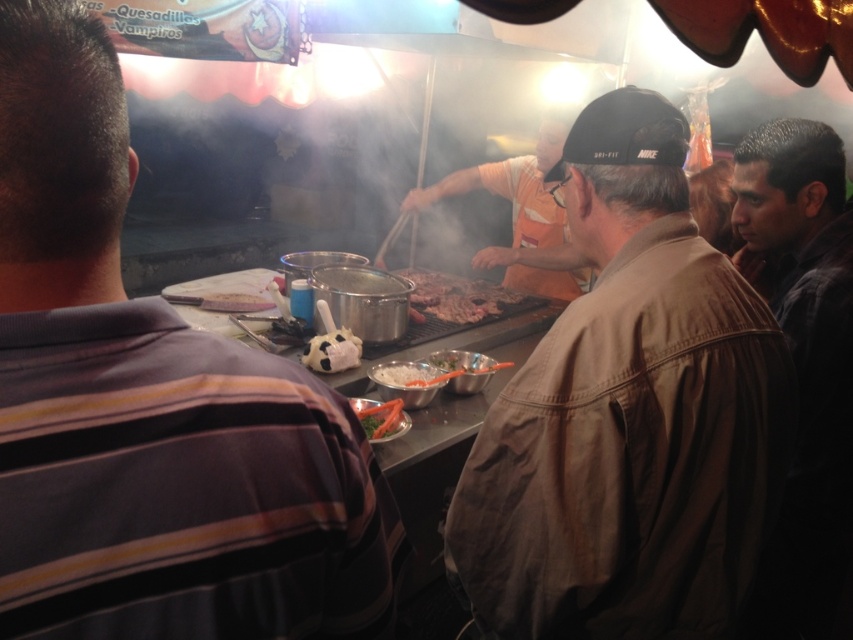
Is the position of dark brown leather jacket at right less distant than that of white matte soccer ball at center?

That is True.

Does dark brown leather jacket at right appear on the right side of white matte soccer ball at center?

Indeed, dark brown leather jacket at right is positioned on the right side of white matte soccer ball at center.

I want to click on dark brown leather jacket at right, so click(x=802, y=355).

From the picture: Who is taller, brown cotton jacket at center or orange fabric shirt at center?

brown cotton jacket at center

Between point (538, 372) and point (572, 260), which one is positioned in front?

Point (538, 372) is in front.

Measure the distance between brown cotton jacket at center and camera.

They are 39.30 inches apart.

I want to click on brown cotton jacket at center, so click(x=630, y=417).

Is dark brown leather jacket at right behind grilled meat at center?

No, dark brown leather jacket at right is in front of grilled meat at center.

The image size is (853, 640). Describe the element at coordinates (802, 355) in the screenshot. I see `dark brown leather jacket at right` at that location.

Image resolution: width=853 pixels, height=640 pixels. I want to click on dark brown leather jacket at right, so click(x=802, y=355).